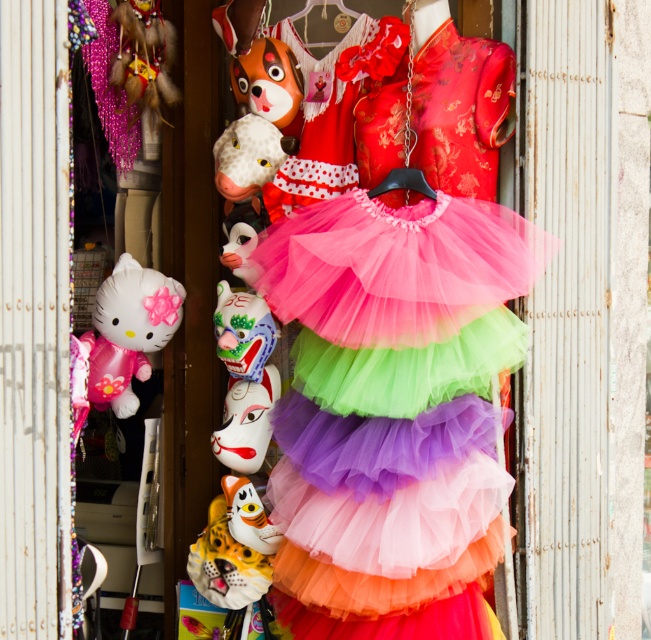
You are a shop assistant organizing items in the store. You need to place the matte orange mask at upper center and the white plush toy at center into a display case that can only hold one of them. Which item should you choose to fit in the display case?

The matte orange mask at upper center occupies less space than the white plush toy at center, so you should choose the matte orange mask at upper center to fit in the display case.

You are a shop assistant organizing the masks in the store. You need to place the matte orange mask at upper center and the porcelain painted mask at center into a display case that can only fit one of them. Which mask should you choose to fit into the display case?

The matte orange mask at upper center occupies less space than the porcelain painted mask at center, so you should choose the matte orange mask at upper center to fit into the display case.

You are a customer at the store and want to choose between the pastel tulle skirt at center and the matte pink plush at left. Which item has a greater width?

The pastel tulle skirt at center has a greater width than the matte pink plush at left.